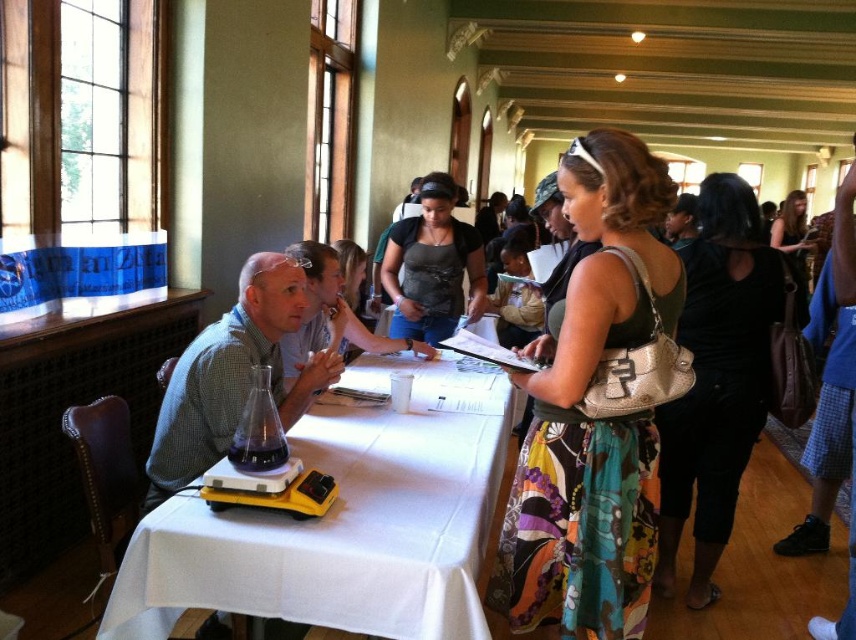
Which of these two, matte black tank top at center or matte gray tank top at center, stands taller?

With more height is matte black tank top at center.

Between point (452, 225) and point (357, 298), which one is positioned in front?

Point (452, 225) is in front.

This screenshot has height=640, width=856. I want to click on matte black tank top at center, so click(432, 266).

Is black velvet dress at center thinner than dark brown leather purse at upper right?

Indeed, black velvet dress at center has a lesser width compared to dark brown leather purse at upper right.

Is point (667, 513) behind point (801, 227)?

No, (667, 513) is in front of (801, 227).

Locate an element on the screen. black velvet dress at center is located at coordinates (717, 378).

Find the location of a particular element. Image resolution: width=856 pixels, height=640 pixels. black velvet dress at center is located at coordinates (717, 378).

Which is more to the right, multicolored fabric skirt at center or dark brown leather purse at upper right?

dark brown leather purse at upper right is more to the right.

The width and height of the screenshot is (856, 640). What are the coordinates of `multicolored fabric skirt at center` in the screenshot? It's located at (586, 416).

Find the location of a particular element. multicolored fabric skirt at center is located at coordinates (586, 416).